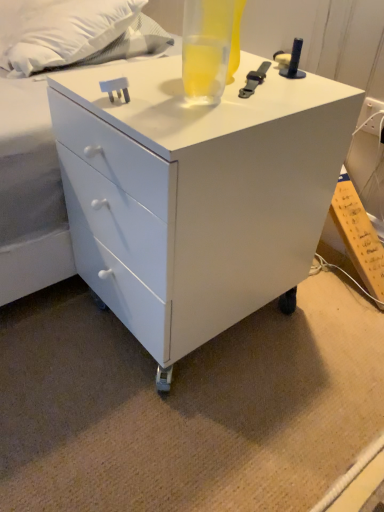
The image size is (384, 512). Identify the location of white soft pillow at upper left. (59, 31).

What do you see at coordinates (59, 31) in the screenshot? I see `white soft pillow at upper left` at bounding box center [59, 31].

Where is `white glossy chest of drawers at center`? This screenshot has height=512, width=384. white glossy chest of drawers at center is located at coordinates (196, 194).

Which point is more forward, (230, 40) or (276, 172)?

The point (276, 172) is closer to the camera.

How distant is translucent glass beverage at top from white glossy chest of drawers at center?

A distance of 9.34 inches exists between translucent glass beverage at top and white glossy chest of drawers at center.

From the image's perspective, which object appears higher, translucent glass beverage at top or white glossy chest of drawers at center?

translucent glass beverage at top, from the image's perspective.

Locate an element on the screen. beverage that appears above the white glossy chest of drawers at center (from a real-world perspective) is located at coordinates (209, 47).

In the scene shown: Could you tell me if white glossy chest of drawers at center is facing translucent glass beverage at top?

No, white glossy chest of drawers at center is not turned towards translucent glass beverage at top.

Is white glossy chest of drawers at center shorter than translucent glass beverage at top?

In fact, white glossy chest of drawers at center may be taller than translucent glass beverage at top.

Considering the relative sizes of white glossy chest of drawers at center and translucent glass beverage at top in the image provided, is white glossy chest of drawers at center smaller than translucent glass beverage at top?

Actually, white glossy chest of drawers at center might be larger than translucent glass beverage at top.

In the scene shown: Is white glossy chest of drawers at center not near translucent glass beverage at top?

No.

In the scene shown: From the image's perspective, is white glossy chest of drawers at center located above or below white soft pillow at upper left?

white glossy chest of drawers at center is below white soft pillow at upper left.

Is point (114, 110) positioned before point (99, 29)?

Yes, point (114, 110) is in front of point (99, 29).

Could you tell me if white glossy chest of drawers at center is facing white soft pillow at upper left?

No, white glossy chest of drawers at center does not turn towards white soft pillow at upper left.

Where is `chest of drawers below the white soft pillow at upper left (from the image's perspective)`? The width and height of the screenshot is (384, 512). chest of drawers below the white soft pillow at upper left (from the image's perspective) is located at coordinates (196, 194).

From the picture: Is white soft pillow at upper left to the right of white glossy chest of drawers at center from the viewer's perspective?

In fact, white soft pillow at upper left is to the left of white glossy chest of drawers at center.

Is white soft pillow at upper left wider than white glossy chest of drawers at center?

In fact, white soft pillow at upper left might be narrower than white glossy chest of drawers at center.

Consider the image. Would you say white soft pillow at upper left contains white glossy chest of drawers at center?

No, white glossy chest of drawers at center is not surrounded by white soft pillow at upper left.

From their relative heights in the image, would you say white soft pillow at upper left is taller or shorter than translucent glass beverage at top?

In the image, white soft pillow at upper left appears to be taller than translucent glass beverage at top.

From the image's perspective, between white soft pillow at upper left and translucent glass beverage at top, which one is located above?

white soft pillow at upper left appears higher in the image.

Which of these two, white soft pillow at upper left or translucent glass beverage at top, is thinner?

Thinner between the two is translucent glass beverage at top.

Is white soft pillow at upper left turned away from translucent glass beverage at top?

No, white soft pillow at upper left is not facing away from translucent glass beverage at top.

Is translucent glass beverage at top not within white soft pillow at upper left?

translucent glass beverage at top is positioned outside white soft pillow at upper left.

Based on the photo, from the image's perspective, would you say translucent glass beverage at top is shown under white soft pillow at upper left?

Indeed, from the image's perspective, translucent glass beverage at top is shown beneath white soft pillow at upper left.

The width and height of the screenshot is (384, 512). What are the coordinates of `pillow that is under the translucent glass beverage at top (from a real-world perspective)` in the screenshot? It's located at click(59, 31).

Could you tell me if translucent glass beverage at top is facing white soft pillow at upper left?

No.

Identify the location of chest of drawers below the translucent glass beverage at top (from the image's perspective). This screenshot has width=384, height=512. (196, 194).

The image size is (384, 512). In order to click on beverage above the white glossy chest of drawers at center (from the image's perspective) in this screenshot , I will do `click(209, 47)`.

When comparing their distances from white soft pillow at upper left, does translucent glass beverage at top or white glossy chest of drawers at center seem closer?

Among the two, translucent glass beverage at top is located nearer to white soft pillow at upper left.

Based on their spatial positions, is white glossy chest of drawers at center or translucent glass beverage at top closer to white soft pillow at upper left?

Based on the image, translucent glass beverage at top appears to be nearer to white soft pillow at upper left.

Based on their spatial positions, is white soft pillow at upper left or translucent glass beverage at top further from white glossy chest of drawers at center?

white soft pillow at upper left is positioned further to the anchor white glossy chest of drawers at center.

When comparing their distances from translucent glass beverage at top, does white glossy chest of drawers at center or white soft pillow at upper left seem closer?

white glossy chest of drawers at center lies closer to translucent glass beverage at top than the other object.

Looking at the image, which one is located closer to translucent glass beverage at top, white soft pillow at upper left or white glossy chest of drawers at center?

The object closer to translucent glass beverage at top is white glossy chest of drawers at center.

From the image, which object appears to be nearer to white glossy chest of drawers at center, translucent glass beverage at top or white soft pillow at upper left?

translucent glass beverage at top.

Image resolution: width=384 pixels, height=512 pixels. In order to click on beverage between white soft pillow at upper left and white glossy chest of drawers at center from top to bottom in this screenshot , I will do `click(209, 47)`.